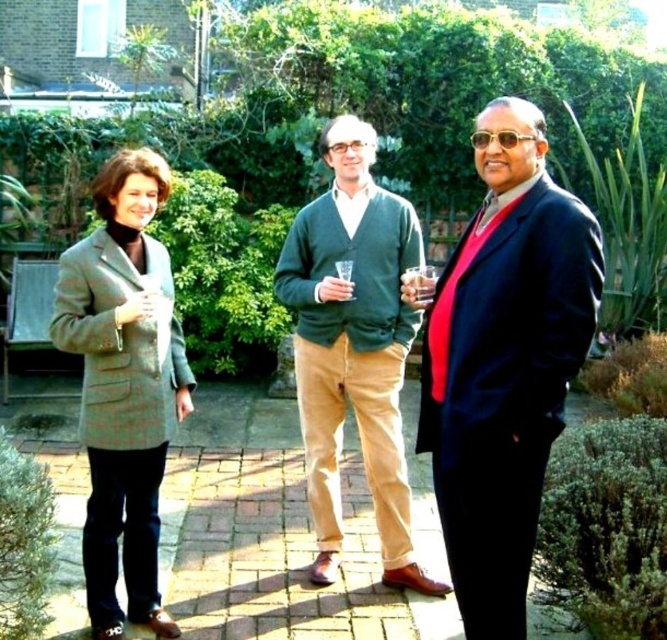
You are a photographer setting up a shoot in the garden. You need to position a light source so it illuminates the green cardigan at center without casting a shadow on the plaid wool coat at left. Is this possible based on their positions?

The green cardigan at center is located above the plaid wool coat at left, so positioning the light source above the green cardigan at center would cast light downward, potentially illuminating it while avoiding the lower positioned plaid wool coat at left. This setup might work depending on the exact angle and distance.

You are standing at the camera position and want to walk directly to the point marked at coordinates (532, 426). How far will you have to walk?

The point marked at coordinates (532, 426) is 2.93 meters away from the camera, so you will have to walk 2.93 meters to reach it.

You are a tailor who needs to determine which garment requires more fabric to alter. You have a navy blue suit at center and a plaid wool coat at left. Based on their sizes, which one would need more fabric?

The navy blue suit at center requires more fabric because it is larger in size than the plaid wool coat at left.